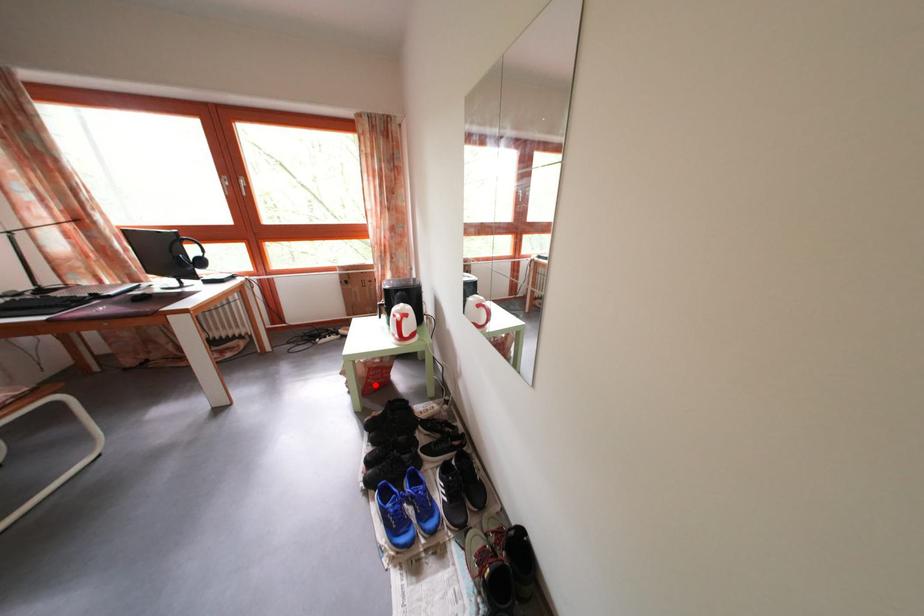
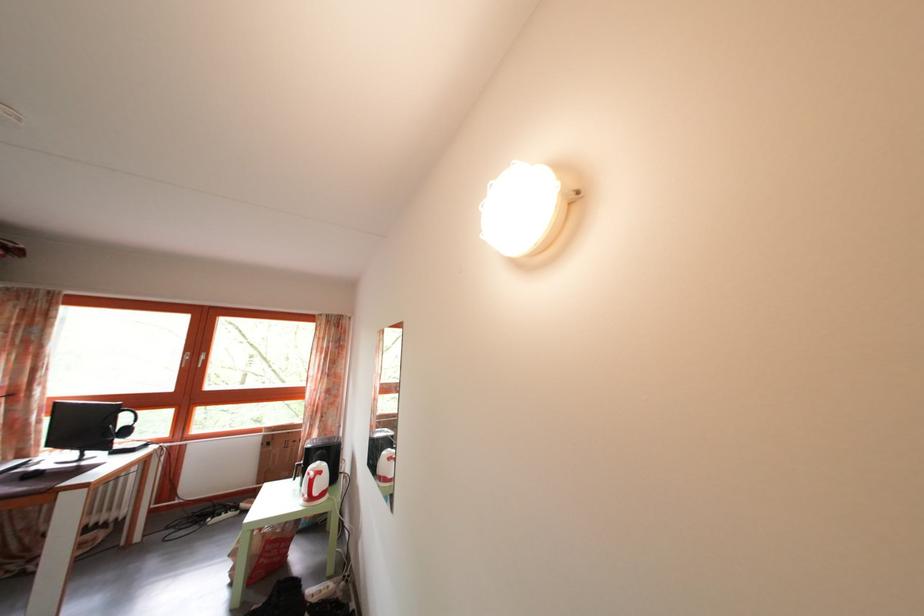
Question: I am providing you with two images of the same scene from different viewpoints. Image1 has a red point marked. In image2, the corresponding 3D location appears at what relative position? Reply with the corresponding letter.

Choices:
 (A) Closer
 (B) Farther

Answer: (A)